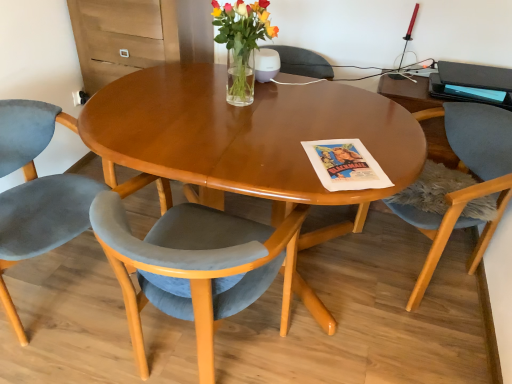
Question: Considering the relative sizes of velvet blue chair at lower right, which is the first chair in right-to-left order, and velvet grey chair at lower left, acting as the 2th chair starting from the left, in the image provided, is velvet blue chair at lower right, which is the first chair in right-to-left order, smaller than velvet grey chair at lower left, acting as the 2th chair starting from the left,?

Choices:
 (A) yes
 (B) no

Answer: (B)

Question: From a real-world perspective, is velvet blue chair at lower right, marked as the third chair in a left-to-right arrangement, on top of velvet grey chair at lower left, placed as the second chair when sorted from right to left?

Choices:
 (A) yes
 (B) no

Answer: (A)

Question: From a real-world perspective, is velvet blue chair at lower right, which is the first chair in right-to-left order, positioned under velvet grey chair at lower left, placed as the second chair when sorted from right to left, based on gravity?

Choices:
 (A) no
 (B) yes

Answer: (A)

Question: From the image's perspective, does velvet blue chair at lower right, marked as the third chair in a left-to-right arrangement, appear higher than velvet grey chair at lower left, acting as the 2th chair starting from the left?

Choices:
 (A) yes
 (B) no

Answer: (A)

Question: Is velvet blue chair at lower right, which is the first chair in right-to-left order, surrounding velvet grey chair at lower left, acting as the 2th chair starting from the left?

Choices:
 (A) no
 (B) yes

Answer: (A)

Question: Can you confirm if velvet blue chair at lower right, marked as the third chair in a left-to-right arrangement, is positioned to the left of velvet grey chair at lower left, acting as the 2th chair starting from the left?

Choices:
 (A) no
 (B) yes

Answer: (A)

Question: Can you confirm if velvet grey chair at lower left, which is the 1th chair in left-to-right order, is bigger than matte black magazine at upper right?

Choices:
 (A) yes
 (B) no

Answer: (A)

Question: Does velvet grey chair at lower left, which is the 1th chair in left-to-right order, appear on the right side of matte black magazine at upper right?

Choices:
 (A) yes
 (B) no

Answer: (B)

Question: From the image's perspective, is velvet grey chair at lower left, which is the 1th chair in left-to-right order, located beneath matte black magazine at upper right?

Choices:
 (A) yes
 (B) no

Answer: (A)

Question: Is velvet grey chair at lower left, which is the 1th chair in left-to-right order, beside matte black magazine at upper right?

Choices:
 (A) no
 (B) yes

Answer: (A)

Question: Is the position of velvet grey chair at lower left, which is the 1th chair in left-to-right order, more distant than that of matte black magazine at upper right?

Choices:
 (A) no
 (B) yes

Answer: (A)

Question: Is matte black magazine at upper right at the back of velvet grey chair at lower left, which is the 1th chair in left-to-right order?

Choices:
 (A) yes
 (B) no

Answer: (B)